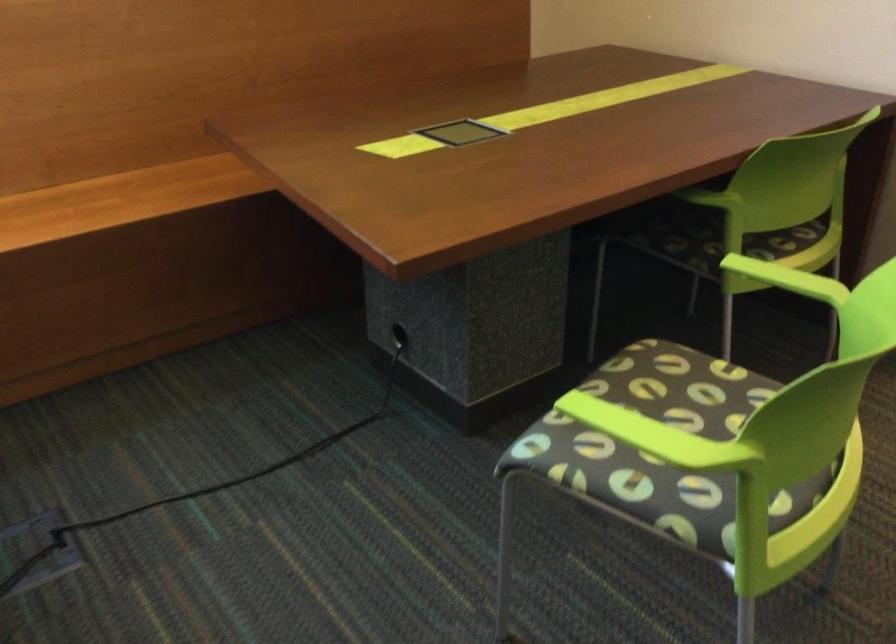
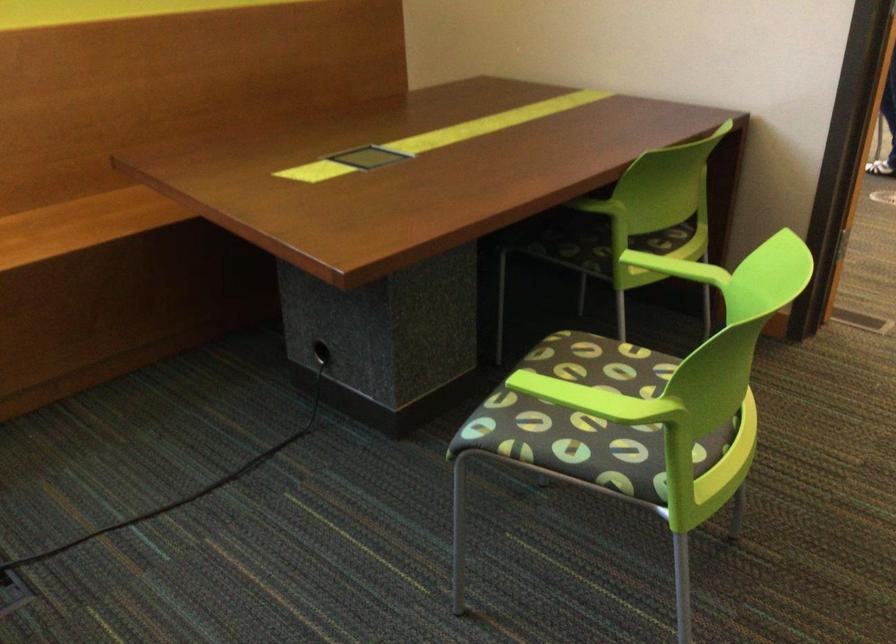
Locate, in the second image, the point that corresponds to the point at 176,190 in the first image.

(80, 223)